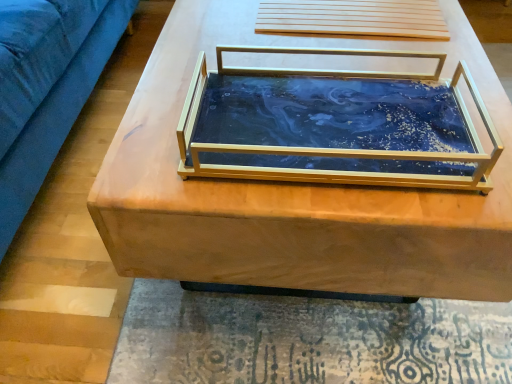
Question: From a real-world perspective, is marble-like blue tray at center physically located above or below wooden table at center?

Choices:
 (A) below
 (B) above

Answer: (B)

Question: Is marble-like blue tray at center taller or shorter than wooden table at center?

Choices:
 (A) short
 (B) tall

Answer: (A)

Question: Based on their positions, is marble-like blue tray at center located to the left or right of wooden table at center?

Choices:
 (A) right
 (B) left

Answer: (B)

Question: Is point 244,218 closer or farther from the camera than point 462,142?

Choices:
 (A) closer
 (B) farther

Answer: (A)

Question: Would you say wooden table at center is inside or outside marble-like blue tray at center?

Choices:
 (A) outside
 (B) inside

Answer: (A)

Question: Is wooden table at center wider or thinner than marble-like blue tray at center?

Choices:
 (A) thin
 (B) wide

Answer: (B)

Question: Is wooden table at center in front of or behind marble-like blue tray at center in the image?

Choices:
 (A) behind
 (B) front

Answer: (A)